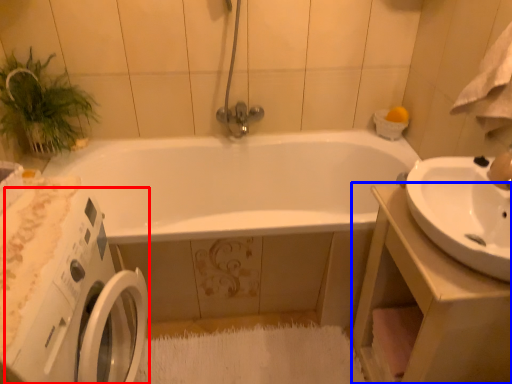
Question: Among these objects, which one is nearest to the camera, washing machine (highlighted by a red box) or counter top (highlighted by a blue box)?

Choices:
 (A) washing machine
 (B) counter top

Answer: (A)